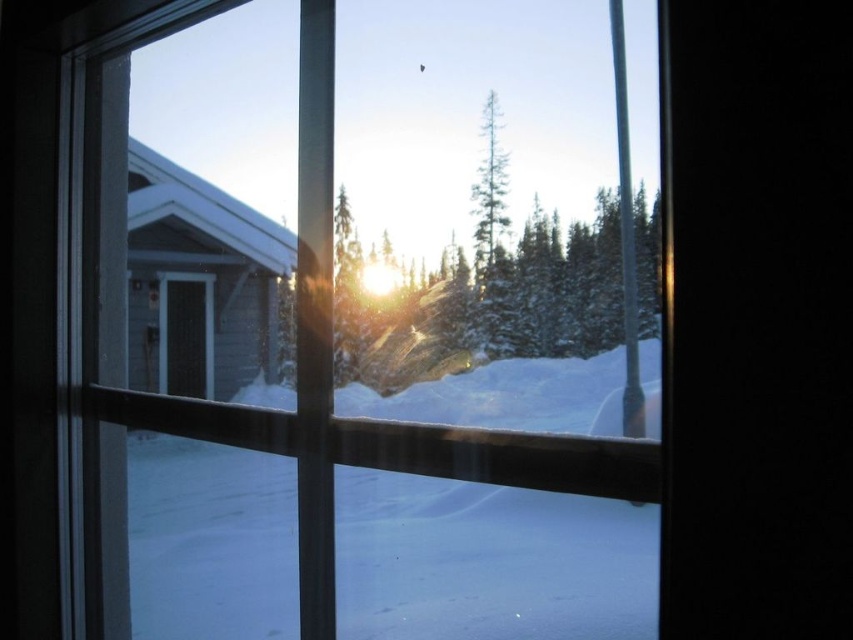
You are standing in front of the window and see two points marked in the image. Which point is closer to you, point (x=235, y=333) or point (x=477, y=205)?

Point (x=235, y=333) is closer to you than point (x=477, y=205) because it is further to the viewer.